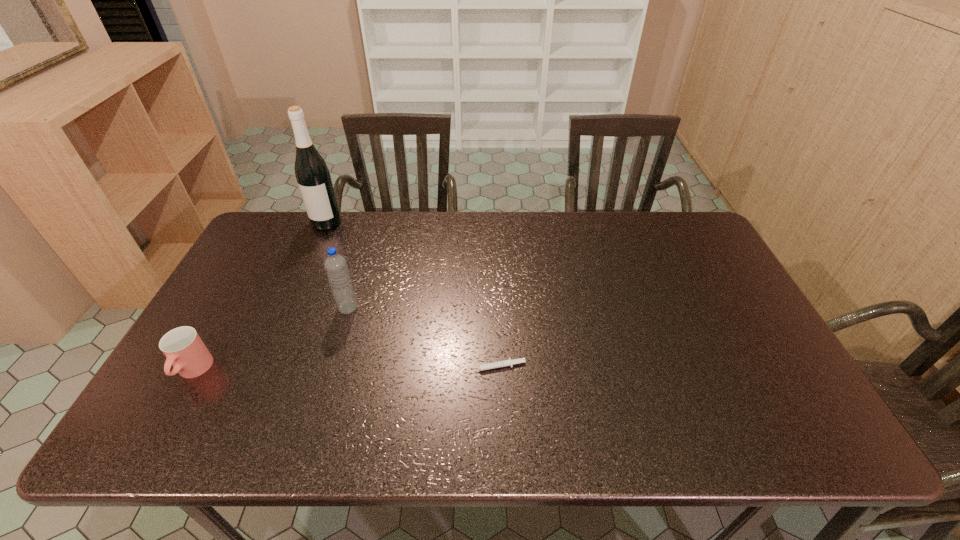
The height and width of the screenshot is (540, 960). I want to click on wine bottle, so click(312, 174).

The image size is (960, 540). Find the location of `the tallest object`. the tallest object is located at coordinates (312, 174).

In order to click on the second object from right to left in this screenshot , I will do `click(335, 265)`.

The height and width of the screenshot is (540, 960). I want to click on the third nearest object, so click(335, 265).

What are the coordinates of `cup` in the screenshot? It's located at (x=184, y=349).

Find the location of `the leftmost object`. the leftmost object is located at coordinates (184, 349).

You are a GUI agent. You are given a task and a screenshot of the screen. Output one action in this format:
    pyautogui.click(x=<x>, y=<y>)
    Task: Click on the syringe
    This screenshot has height=540, width=960.
    Given the screenshot: What is the action you would take?
    pyautogui.click(x=504, y=363)

The width and height of the screenshot is (960, 540). I want to click on the rightmost object, so click(x=504, y=363).

Identify the location of vacant area located on the label of the tallest object. (288, 310).

The height and width of the screenshot is (540, 960). Find the location of `free point located on the back of the water bottle`. free point located on the back of the water bottle is located at coordinates (356, 282).